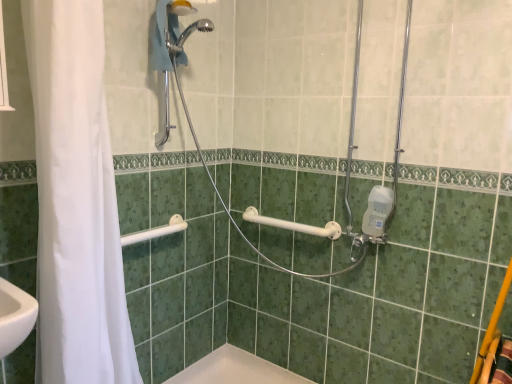
What are the coordinates of `metallic silver shower at center, the 2th shower positioned from the bottom` in the screenshot? It's located at (345, 169).

Measure the distance between point (326, 226) and camera.

The distance of point (326, 226) from camera is 1.87 meters.

What is the approximate width of white plastic grab bar at upper left, which is the third shower from top to bottom?

white plastic grab bar at upper left, which is the third shower from top to bottom, is 4.55 inches wide.

Identify the location of metallic silver shower at center, the 2th shower positioned from the bottom. (345, 169).

Considering the sizes of objects white fabric shower curtain at left and metallic silver shower at center, positioned as the second shower in top-to-bottom order, in the image provided, who is taller, white fabric shower curtain at left or metallic silver shower at center, positioned as the second shower in top-to-bottom order,?

Standing taller between the two is white fabric shower curtain at left.

Looking at the image, does white fabric shower curtain at left seem bigger or smaller compared to metallic silver shower at center, positioned as the second shower in top-to-bottom order?

In the image, white fabric shower curtain at left appears to be smaller than metallic silver shower at center, positioned as the second shower in top-to-bottom order.

Between point (64, 200) and point (313, 278), which one is positioned in front?

Positioned in front is point (64, 200).

Image resolution: width=512 pixels, height=384 pixels. I want to click on shower curtain on the left side of white plastic towel bar at center, so click(76, 201).

Is white plastic towel bar at center at the right side of white fabric shower curtain at left?

Correct, you'll find white plastic towel bar at center to the right of white fabric shower curtain at left.

Considering the relative sizes of white plastic towel bar at center and white fabric shower curtain at left in the image provided, is white plastic towel bar at center thinner than white fabric shower curtain at left?

Correct, the width of white plastic towel bar at center is less than that of white fabric shower curtain at left.

Consider the image. Measure the distance between white plastic towel bar at center and white fabric shower curtain at left.

white plastic towel bar at center and white fabric shower curtain at left are 38.21 inches apart.

Can you confirm if metallic silver shower at center, the 2th shower positioned from the bottom, is shorter than white plastic towel bar at center?

In fact, metallic silver shower at center, the 2th shower positioned from the bottom, may be taller than white plastic towel bar at center.

How many degrees apart are the facing directions of metallic silver shower at center, the 2th shower positioned from the bottom, and white plastic towel bar at center?

The facing directions of metallic silver shower at center, the 2th shower positioned from the bottom, and white plastic towel bar at center are 89.9 degrees apart.

Is the surface of metallic silver shower at center, the 2th shower positioned from the bottom, in direct contact with white plastic towel bar at center?

metallic silver shower at center, the 2th shower positioned from the bottom, and white plastic towel bar at center are clearly separated.

Is metallic silver shower at center, positioned as the second shower in top-to-bottom order, to the right of white plastic towel bar at center from the viewer's perspective?

In fact, metallic silver shower at center, positioned as the second shower in top-to-bottom order, is to the left of white plastic towel bar at center.

Considering the sizes of objects white plastic towel bar at center and metallic silver shower at center, the 2th shower positioned from the bottom, in the image provided, who is taller, white plastic towel bar at center or metallic silver shower at center, the 2th shower positioned from the bottom,?

Standing taller between the two is metallic silver shower at center, the 2th shower positioned from the bottom.

In the image, is white plastic towel bar at center positioned in front of or behind metallic silver shower at center, the 2th shower positioned from the bottom?

white plastic towel bar at center is positioned farther from the viewer than metallic silver shower at center, the 2th shower positioned from the bottom.

Would you consider white plastic towel bar at center to be distant from metallic silver shower at center, the 2th shower positioned from the bottom?

white plastic towel bar at center is near metallic silver shower at center, the 2th shower positioned from the bottom, not far away.

From a real-world perspective, which is physically above, white plastic towel bar at center or metallic silver shower at center, the 2th shower positioned from the bottom?

In real-world perspective, metallic silver shower at center, the 2th shower positioned from the bottom, is above.

Looking at the image, does white plastic towel bar at center seem bigger or smaller compared to white plastic grab bar at upper left, which is the third shower from top to bottom?

Considering their sizes, white plastic towel bar at center takes up more space than white plastic grab bar at upper left, which is the third shower from top to bottom.

From the image's perspective, between white plastic towel bar at center and white plastic grab bar at upper left, the 1th shower in the bottom-to-top sequence, which one is located above?

white plastic towel bar at center is shown above in the image.

Between point (253, 213) and point (163, 228), which one is positioned behind?

Positioned behind is point (253, 213).

Is white plastic towel bar at center further to the viewer compared to white plastic grab bar at upper left, which is the third shower from top to bottom?

That is True.

Between chrome metallic shower head at upper center, the third shower positioned from the bottom, and white plastic grab bar at upper left, the 1th shower in the bottom-to-top sequence, which one has smaller size?

With smaller size is white plastic grab bar at upper left, the 1th shower in the bottom-to-top sequence.

At what (x,y) coordinates should I click in order to perform the action: click on shower that is the 2nd one when counting upward from the white plastic grab bar at upper left, which is the third shower from top to bottom (from the image's perspective). Please return your answer as a coordinate pair (x, y). The image size is (512, 384). Looking at the image, I should click on (187, 27).

Is chrome metallic shower head at upper center, the third shower positioned from the bottom, facing towards white plastic grab bar at upper left, the 1th shower in the bottom-to-top sequence?

No.

Which is closer, (181, 45) or (134, 237)?

Clearly, point (181, 45) is closer to the camera than point (134, 237).

Considering the relative sizes of white fabric shower curtain at left and chrome metallic shower head at upper center, positioned as the 1th shower in top-to-bottom order, in the image provided, is white fabric shower curtain at left wider than chrome metallic shower head at upper center, positioned as the 1th shower in top-to-bottom order,?

Yes.

Is point (57, 309) closer or farther from the camera than point (166, 33)?

Point (57, 309) is positioned closer to the camera compared to point (166, 33).

From their relative heights in the image, would you say white fabric shower curtain at left is taller or shorter than chrome metallic shower head at upper center, positioned as the 1th shower in top-to-bottom order?

In the image, white fabric shower curtain at left appears to be taller than chrome metallic shower head at upper center, positioned as the 1th shower in top-to-bottom order.

Locate an element on the screen. Image resolution: width=512 pixels, height=384 pixels. the 3rd shower to the right of the white fabric shower curtain at left, counting from the anchor's position is located at coordinates (345, 169).

Where is `towel bar beneath the white fabric shower curtain at left (from a real-world perspective)`? towel bar beneath the white fabric shower curtain at left (from a real-world perspective) is located at coordinates (294, 225).

When comparing their distances from white fabric shower curtain at left, does metallic silver shower at center, positioned as the second shower in top-to-bottom order, or white plastic grab bar at upper left, which is the third shower from top to bottom, seem further?

metallic silver shower at center, positioned as the second shower in top-to-bottom order, lies further to white fabric shower curtain at left than the other object.

Based on their spatial positions, is metallic silver shower at center, the 2th shower positioned from the bottom, or white fabric shower curtain at left further from chrome metallic shower head at upper center, positioned as the 1th shower in top-to-bottom order?

Among the two, metallic silver shower at center, the 2th shower positioned from the bottom, is located further to chrome metallic shower head at upper center, positioned as the 1th shower in top-to-bottom order.

Estimate the real-world distances between objects in this image. Which object is closer to white plastic towel bar at center, white fabric shower curtain at left or metallic silver shower at center, the 2th shower positioned from the bottom?

metallic silver shower at center, the 2th shower positioned from the bottom.

Estimate the real-world distances between objects in this image. Which object is closer to white fabric shower curtain at left, white plastic towel bar at center or white plastic grab bar at upper left, which is the third shower from top to bottom?

white plastic grab bar at upper left, which is the third shower from top to bottom, is positioned closer to the anchor white fabric shower curtain at left.

Based on their spatial positions, is chrome metallic shower head at upper center, the third shower positioned from the bottom, or white plastic grab bar at upper left, which is the third shower from top to bottom, closer to white plastic towel bar at center?

white plastic grab bar at upper left, which is the third shower from top to bottom, lies closer to white plastic towel bar at center than the other object.

Which object lies further to the anchor point metallic silver shower at center, positioned as the second shower in top-to-bottom order, white fabric shower curtain at left or white plastic towel bar at center?

Among the two, white fabric shower curtain at left is located further to metallic silver shower at center, positioned as the second shower in top-to-bottom order.

When comparing their distances from white fabric shower curtain at left, does white plastic grab bar at upper left, the 1th shower in the bottom-to-top sequence, or chrome metallic shower head at upper center, the third shower positioned from the bottom, seem closer?

white plastic grab bar at upper left, the 1th shower in the bottom-to-top sequence, is closer to white fabric shower curtain at left.

From the image, which object appears to be nearer to metallic silver shower at center, positioned as the second shower in top-to-bottom order, white fabric shower curtain at left or chrome metallic shower head at upper center, positioned as the 1th shower in top-to-bottom order?

The object closer to metallic silver shower at center, positioned as the second shower in top-to-bottom order, is chrome metallic shower head at upper center, positioned as the 1th shower in top-to-bottom order.

This screenshot has height=384, width=512. What are the coordinates of `shower that lies between chrome metallic shower head at upper center, the third shower positioned from the bottom, and white plastic grab bar at upper left, which is the third shower from top to bottom, from top to bottom` in the screenshot? It's located at point(345,169).

The height and width of the screenshot is (384, 512). In order to click on shower curtain between chrome metallic shower head at upper center, positioned as the 1th shower in top-to-bottom order, and white plastic towel bar at center in the up-down direction in this screenshot , I will do `click(76, 201)`.

Identify the location of shower curtain that lies between chrome metallic shower head at upper center, the third shower positioned from the bottom, and white plastic grab bar at upper left, the 1th shower in the bottom-to-top sequence, from top to bottom. (76, 201).

Where is `shower between chrome metallic shower head at upper center, the third shower positioned from the bottom, and white plastic towel bar at center, in the vertical direction`? shower between chrome metallic shower head at upper center, the third shower positioned from the bottom, and white plastic towel bar at center, in the vertical direction is located at coordinates (345, 169).